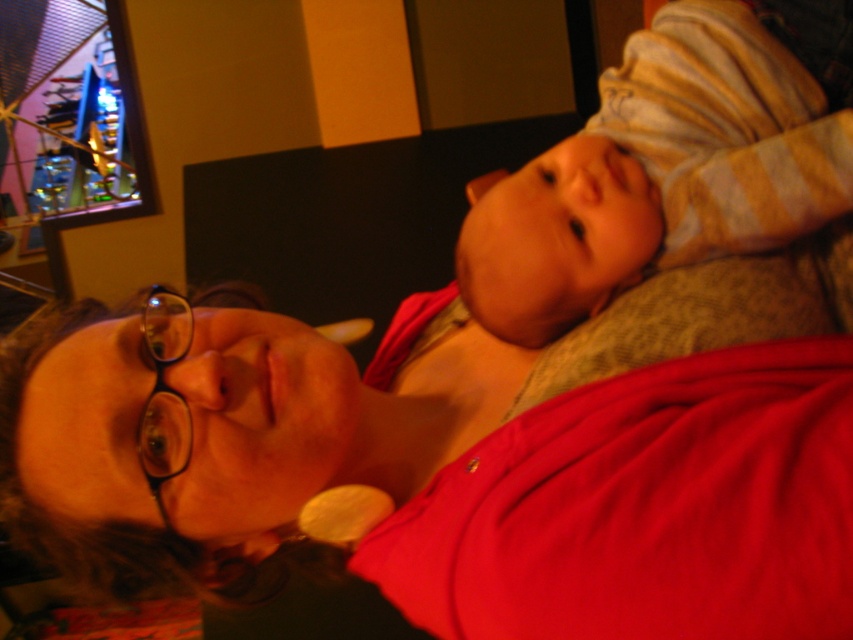
You are a photographer trying to capture a close shot of the matte red shirt at center. You are currently holding the camera 17.83 inches away from the shirt. Can you confirm if this distance is sufficient to ensure the entire shirt fits in the frame?

The matte red shirt at center and camera are 17.83 inches apart, so yes, this distance is sufficient to ensure the entire shirt fits in the frame.

Based on the photo, you are a photographer trying to capture a candid shot of the matte red shirt at center and the striped cotton onesie at upper right. Since you want to ensure both are in focus, you need to know their vertical positions. Which one is placed higher up in the image?

The striped cotton onesie at upper right is higher up because the matte red shirt at center is located below it.

You are a tailor measuring clothing for a customer. You need to determine which garment, the matte red shirt at center or the striped cotton onesie at upper right, requires more fabric in the width dimension. Based on the image, which one do you think needs more fabric?

The matte red shirt at center might be wider than striped cotton onesie at upper right, so it likely requires more fabric in the width dimension.